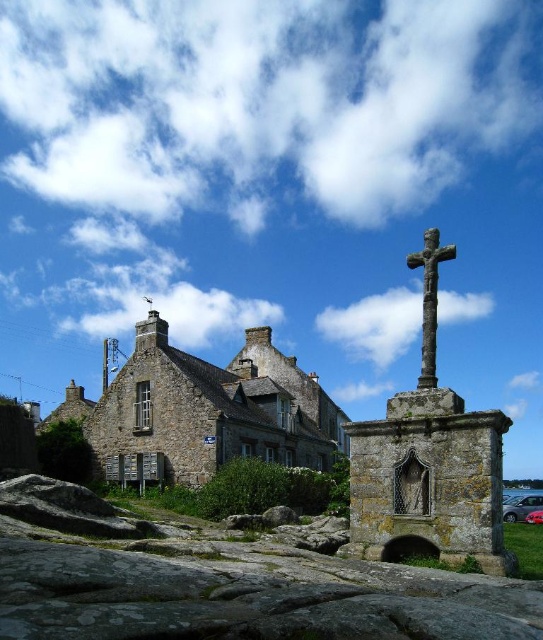
Is stone church at center positioned at the back of rusty stone cross at center?

Yes, it is.

Who is more distant from viewer, (110, 474) or (427, 339)?

Point (110, 474)

This screenshot has width=543, height=640. In order to click on stone church at center in this screenshot , I will do `click(205, 412)`.